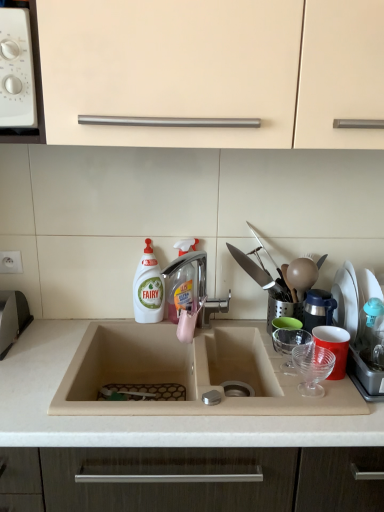
Question: Does transparent plastic spray bottle at center touch silver metallic tap at center?

Choices:
 (A) yes
 (B) no

Answer: (A)

Question: Is transparent plastic spray bottle at center aimed at silver metallic tap at center?

Choices:
 (A) no
 (B) yes

Answer: (B)

Question: Is silver metallic tap at center inside transparent plastic spray bottle at center?

Choices:
 (A) no
 (B) yes

Answer: (A)

Question: Considering the relative positions of transparent plastic spray bottle at center and silver metallic tap at center in the image provided, is transparent plastic spray bottle at center behind silver metallic tap at center?

Choices:
 (A) yes
 (B) no

Answer: (A)

Question: Can you confirm if transparent plastic spray bottle at center is wider than silver metallic tap at center?

Choices:
 (A) no
 (B) yes

Answer: (A)

Question: Considering the relative sizes of transparent plastic spray bottle at center and silver metallic tap at center in the image provided, is transparent plastic spray bottle at center bigger than silver metallic tap at center?

Choices:
 (A) yes
 (B) no

Answer: (B)

Question: Is silver metallic tap at center turned away from white plastic bottle at center?

Choices:
 (A) no
 (B) yes

Answer: (A)

Question: Does silver metallic tap at center contain white plastic bottle at center?

Choices:
 (A) yes
 (B) no

Answer: (B)

Question: Does silver metallic tap at center have a greater height compared to white plastic bottle at center?

Choices:
 (A) yes
 (B) no

Answer: (B)

Question: From the image's perspective, is silver metallic tap at center over white plastic bottle at center?

Choices:
 (A) yes
 (B) no

Answer: (B)

Question: Is silver metallic tap at center bigger than white plastic bottle at center?

Choices:
 (A) yes
 (B) no

Answer: (A)

Question: From a real-world perspective, is silver metallic tap at center physically below white plastic bottle at center?

Choices:
 (A) no
 (B) yes

Answer: (B)

Question: Is white plastic bottle at center thinner than beige matte cabinet at upper center?

Choices:
 (A) no
 (B) yes

Answer: (B)